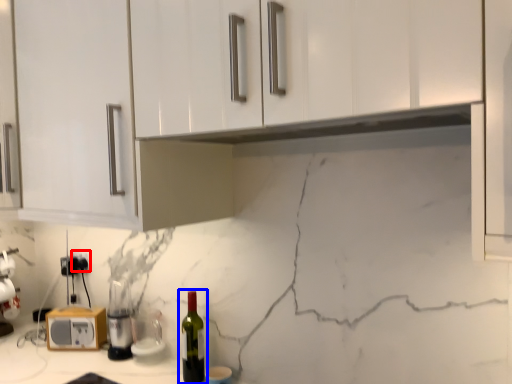
Question: Among these objects, which one is nearest to the camera, electric outlet (highlighted by a red box) or bottle (highlighted by a blue box)?

Choices:
 (A) electric outlet
 (B) bottle

Answer: (B)